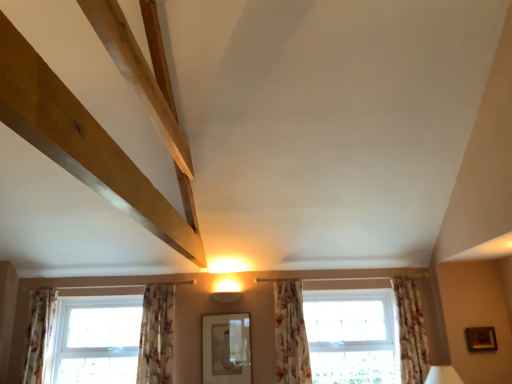
Question: From a real-world perspective, does clear glass window at lower left, the first window from the left, sit lower than natural wood beam at upper left?

Choices:
 (A) yes
 (B) no

Answer: (A)

Question: Is clear glass window at lower left, the first window from the left, taller than natural wood beam at upper left?

Choices:
 (A) no
 (B) yes

Answer: (A)

Question: From the image's perspective, is clear glass window at lower left, which ranks as the 2th window in right-to-left order, located beneath natural wood beam at upper left?

Choices:
 (A) yes
 (B) no

Answer: (A)

Question: Is clear glass window at lower left, the first window from the left, next to natural wood beam at upper left and touching it?

Choices:
 (A) no
 (B) yes

Answer: (A)

Question: Can you confirm if clear glass window at lower left, the first window from the left, is bigger than natural wood beam at upper left?

Choices:
 (A) yes
 (B) no

Answer: (B)

Question: Considering the positions of floral fabric curtain at center, positioned as the 2th curtain in right-to-left order, and floral fabric curtain at right, the first curtain positioned from the right, in the image, is floral fabric curtain at center, positioned as the 2th curtain in right-to-left order, wider or thinner than floral fabric curtain at right, the first curtain positioned from the right,?

Choices:
 (A) wide
 (B) thin

Answer: (B)

Question: Visually, is floral fabric curtain at center, which is the third curtain from left to right, positioned to the left or to the right of floral fabric curtain at right, the fourth curtain positioned from the left?

Choices:
 (A) left
 (B) right

Answer: (A)

Question: Considering their positions, is floral fabric curtain at center, which is the third curtain from left to right, located in front of or behind floral fabric curtain at right, the first curtain positioned from the right?

Choices:
 (A) behind
 (B) front

Answer: (B)

Question: From the image's perspective, is floral fabric curtain at center, which is the third curtain from left to right, above or below floral fabric curtain at right, the first curtain positioned from the right?

Choices:
 (A) below
 (B) above

Answer: (A)

Question: Based on their sizes in the image, would you say matte white lampshade at lower right is bigger or smaller than gold metallic picture frame at lower right?

Choices:
 (A) small
 (B) big

Answer: (B)

Question: Is matte white lampshade at lower right taller or shorter than gold metallic picture frame at lower right?

Choices:
 (A) short
 (B) tall

Answer: (A)

Question: Choose the correct answer: Is matte white lampshade at lower right inside gold metallic picture frame at lower right or outside it?

Choices:
 (A) inside
 (B) outside

Answer: (B)

Question: Considering their positions, is matte white lampshade at lower right located in front of or behind gold metallic picture frame at lower right?

Choices:
 (A) behind
 (B) front

Answer: (B)

Question: Is floral fabric curtain at lower left, placed as the third curtain when sorted from right to left, spatially inside clear glass window at lower left, the first window from the left, or outside of it?

Choices:
 (A) outside
 (B) inside

Answer: (A)

Question: From a real-world perspective, relative to clear glass window at lower left, which ranks as the 2th window in right-to-left order, is floral fabric curtain at lower left, placed as the third curtain when sorted from right to left, vertically above or below?

Choices:
 (A) above
 (B) below

Answer: (A)